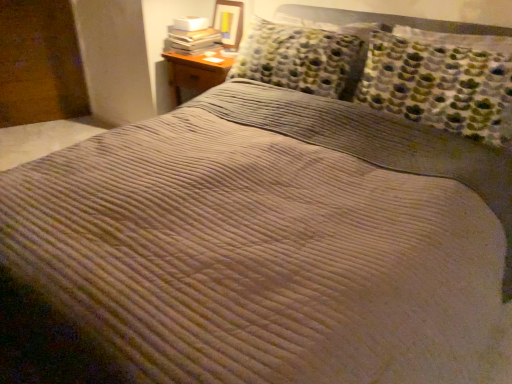
Question: Does matte wooden picture frame at upper center have a smaller size compared to white paper stack at upper left?

Choices:
 (A) yes
 (B) no

Answer: (A)

Question: Is white paper stack at upper left completely or partially inside matte wooden picture frame at upper center?

Choices:
 (A) no
 (B) yes

Answer: (A)

Question: Is matte wooden picture frame at upper center at the left side of white paper stack at upper left?

Choices:
 (A) no
 (B) yes

Answer: (A)

Question: From a real-world perspective, does matte wooden picture frame at upper center stand above white paper stack at upper left?

Choices:
 (A) no
 (B) yes

Answer: (B)

Question: From a real-world perspective, is matte wooden picture frame at upper center beneath white paper stack at upper left?

Choices:
 (A) no
 (B) yes

Answer: (A)

Question: Is matte wooden picture frame at upper center outside of white paper stack at upper left?

Choices:
 (A) yes
 (B) no

Answer: (A)

Question: Is white paper stack at upper left smaller than matte wooden picture frame at upper center?

Choices:
 (A) yes
 (B) no

Answer: (B)

Question: Does white paper stack at upper left have a larger size compared to matte wooden picture frame at upper center?

Choices:
 (A) no
 (B) yes

Answer: (B)

Question: Is white paper stack at upper left at the left side of matte wooden picture frame at upper center?

Choices:
 (A) yes
 (B) no

Answer: (A)

Question: From a real-world perspective, is white paper stack at upper left positioned under matte wooden picture frame at upper center based on gravity?

Choices:
 (A) yes
 (B) no

Answer: (A)

Question: Can you confirm if white paper stack at upper left is shorter than matte wooden picture frame at upper center?

Choices:
 (A) no
 (B) yes

Answer: (B)

Question: Is white paper stack at upper left wider than matte wooden picture frame at upper center?

Choices:
 (A) no
 (B) yes

Answer: (B)

Question: Based on their sizes in the image, would you say matte wooden picture frame at upper center is bigger or smaller than white paper stack at upper left?

Choices:
 (A) small
 (B) big

Answer: (A)